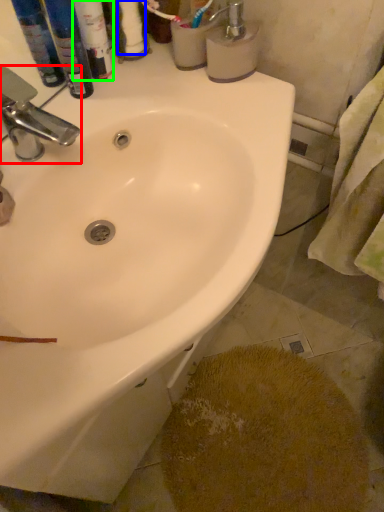
Question: Which object is positioned closest to tap (highlighted by a red box)? Select from toilet paper (highlighted by a blue box) and toiletry (highlighted by a green box).

Choices:
 (A) toilet paper
 (B) toiletry

Answer: (B)